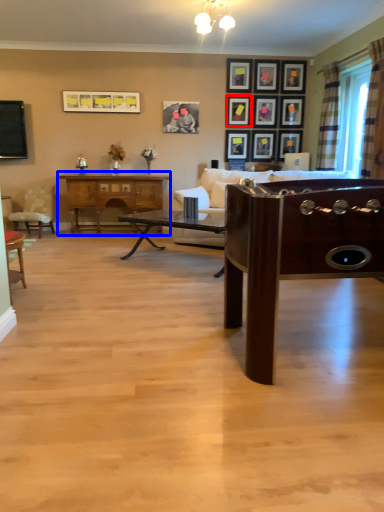
Question: Among these objects, which one is nearest to the camera, picture frame (highlighted by a red box) or desk (highlighted by a blue box)?

Choices:
 (A) picture frame
 (B) desk

Answer: (B)